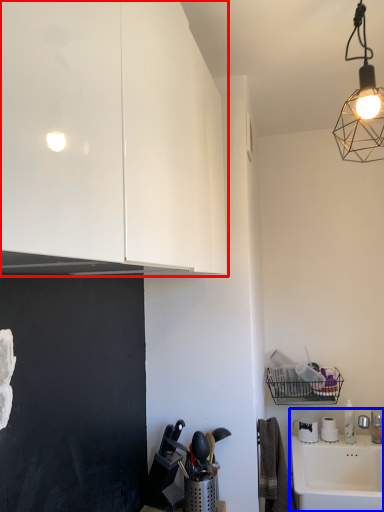
Question: Which point is further to the camera, cabinetry (highlighted by a red box) or sink (highlighted by a blue box)?

Choices:
 (A) cabinetry
 (B) sink

Answer: (B)